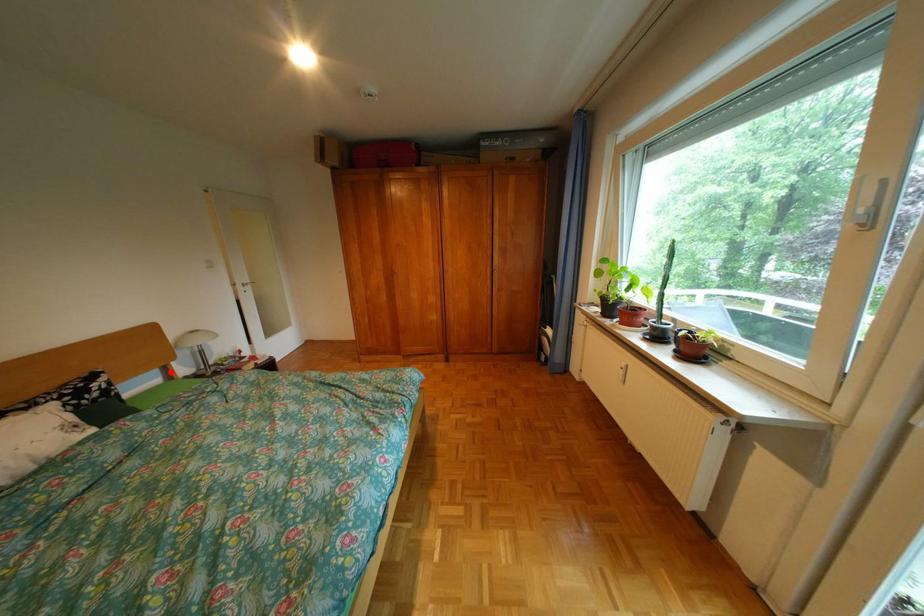
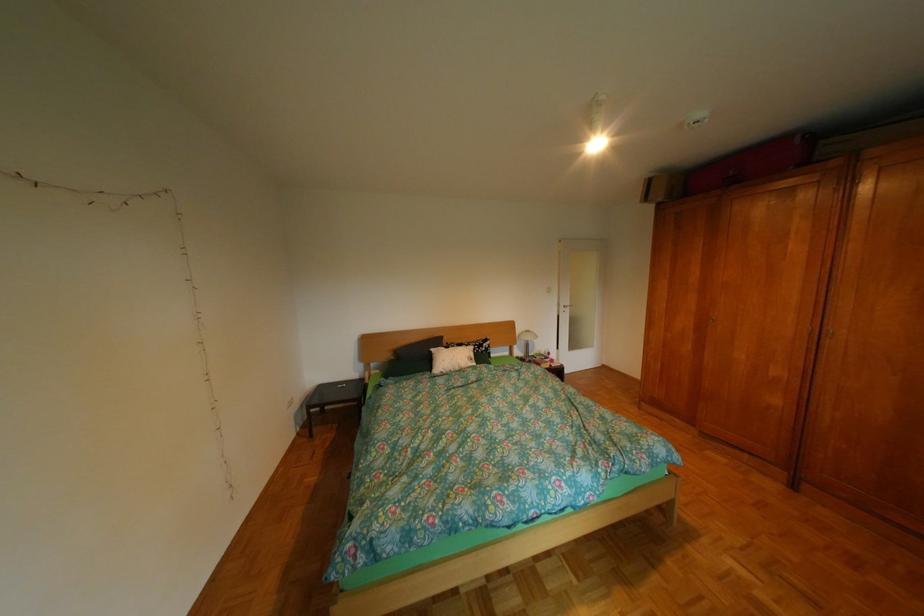
Question: I am providing you with two images of the same scene from different viewpoints. Given a red point in image1, look at the same physical point in image2. Is it:

Choices:
 (A) Closer to the viewpoint
 (B) Farther from the viewpoint

Answer: (B)